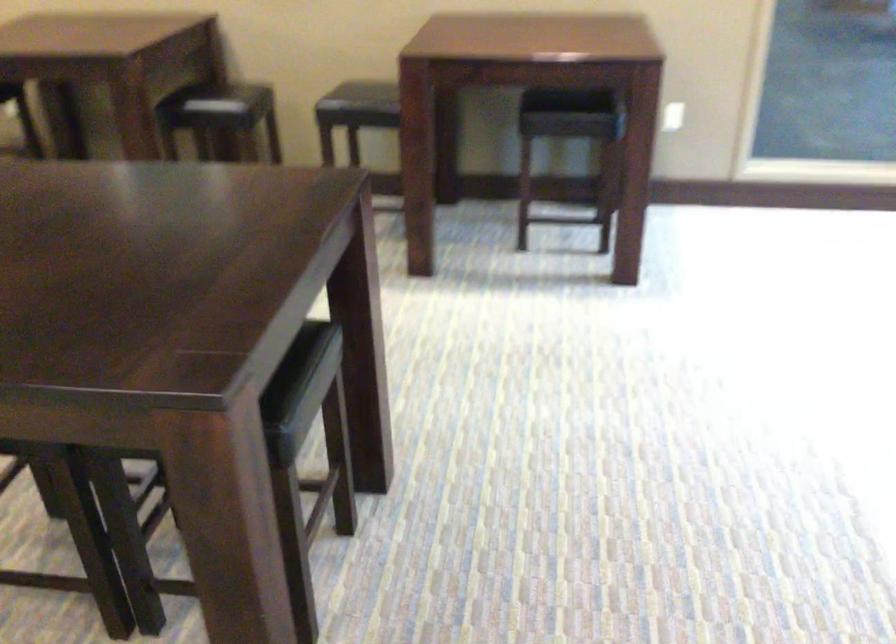
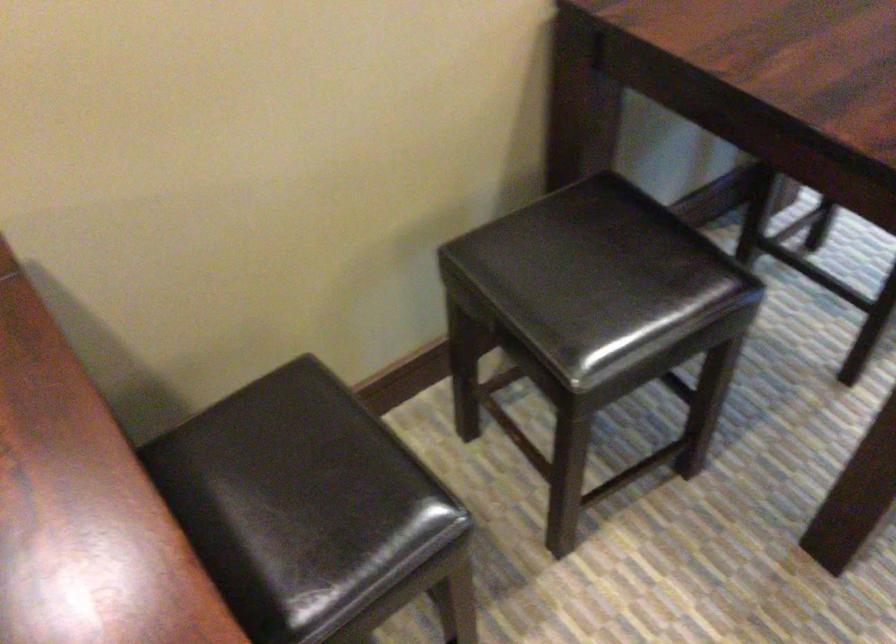
The point at (x=220, y=80) is marked in the first image. Where is the corresponding point in the second image?

(286, 471)